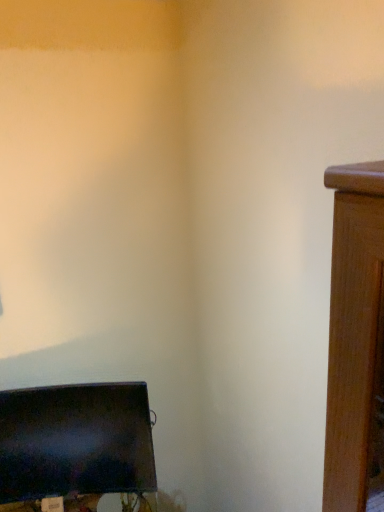
Question: Should I look upward or downward to see matte black monitor at lower left?

Choices:
 (A) down
 (B) up

Answer: (A)